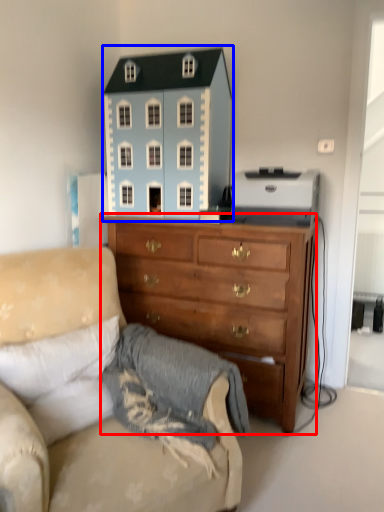
Question: Among these objects, which one is nearest to the camera, chest of drawers (highlighted by a red box) or toy (highlighted by a blue box)?

Choices:
 (A) chest of drawers
 (B) toy

Answer: (A)